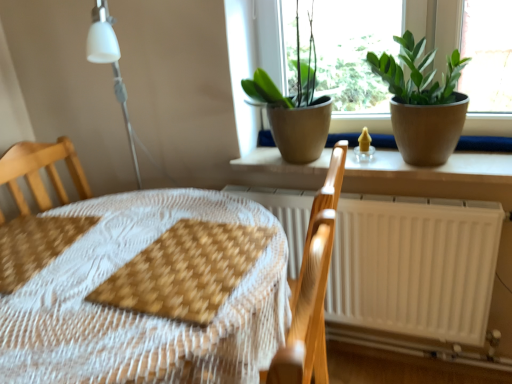
Where is `unoccupied space behind brown woven placemat at center, which is the first sheet in right-to-left order`? unoccupied space behind brown woven placemat at center, which is the first sheet in right-to-left order is located at coordinates (177, 212).